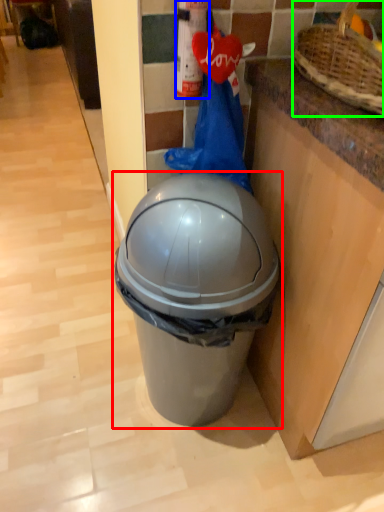
Question: Which object is positioned farthest from waste container (highlighted by a red box)? Select from extinguisher (highlighted by a blue box) and basket (highlighted by a green box).

Choices:
 (A) extinguisher
 (B) basket

Answer: (B)